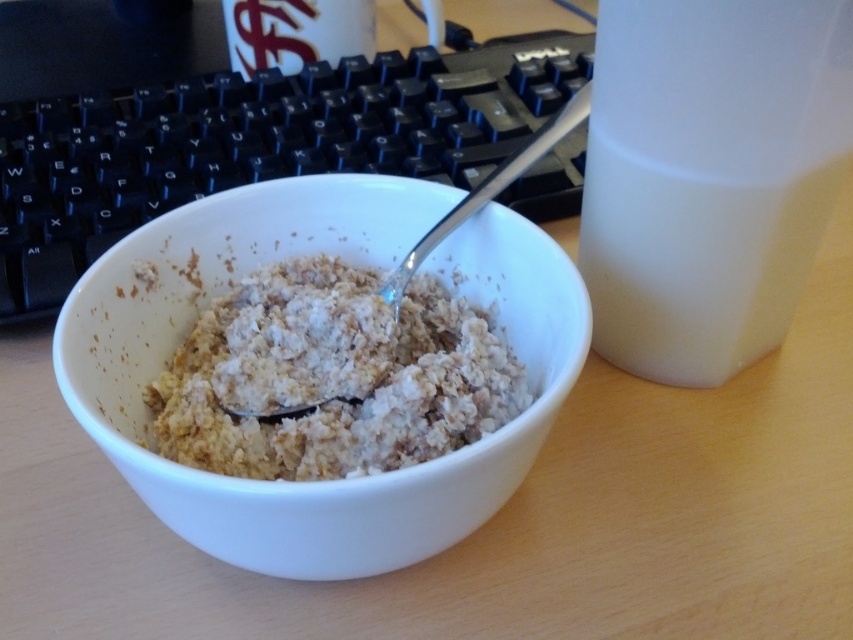
Question: Among these objects, which one is nearest to the camera?

Choices:
 (A) silver metallic spoon at center
 (B) white matte bowl at center
 (C) white textured cereal at center

Answer: (B)

Question: Can you confirm if white matte bowl at center is positioned below silver metallic spoon at center?

Choices:
 (A) no
 (B) yes

Answer: (B)

Question: Does white matte bowl at center appear over black plastic keyboard at center?

Choices:
 (A) no
 (B) yes

Answer: (A)

Question: Which object is farther from the camera taking this photo?

Choices:
 (A) white textured cereal at center
 (B) white opaque jug at right
 (C) black plastic keyboard at center

Answer: (C)

Question: Does white opaque jug at right have a smaller size compared to silver metallic spoon at center?

Choices:
 (A) no
 (B) yes

Answer: (B)

Question: Among these objects, which one is farthest from the camera?

Choices:
 (A) white textured cereal at center
 (B) white opaque jug at right
 (C) black plastic keyboard at center

Answer: (C)